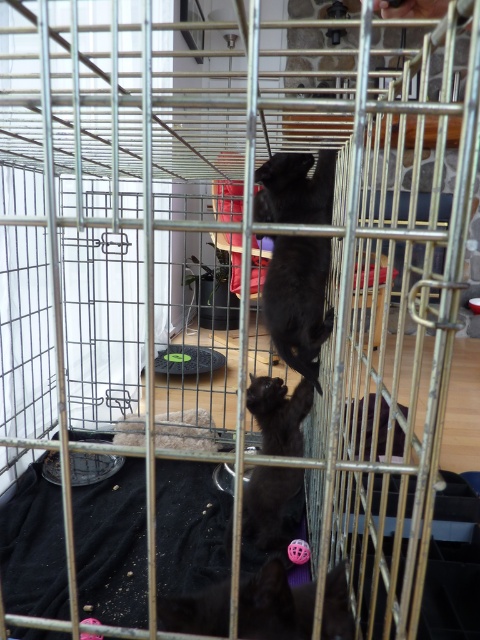
Is point (264, 280) in front of point (299, 416)?

No, it is behind (299, 416).

Can you confirm if black matte fur cat at center is taller than black matte cat at center?

Indeed, black matte fur cat at center has a greater height compared to black matte cat at center.

Is point (272, 300) less distant than point (261, 385)?

No.

At what (x,y) coordinates should I click in order to perform the action: click on black matte fur cat at center. Please return your answer as a coordinate pair (x, y). This screenshot has height=640, width=480. Looking at the image, I should click on (298, 300).